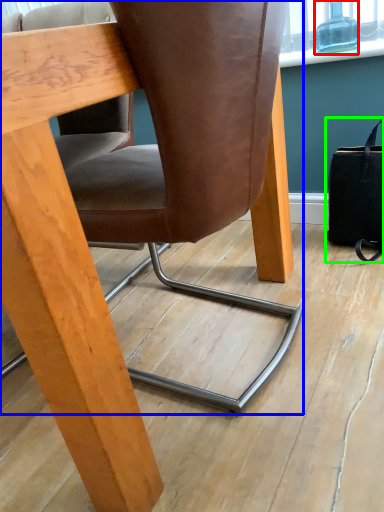
Question: Which is farther away from bottle (highlighted by a red box)? chair (highlighted by a blue box) or handbag (highlighted by a green box)?

Choices:
 (A) chair
 (B) handbag

Answer: (A)